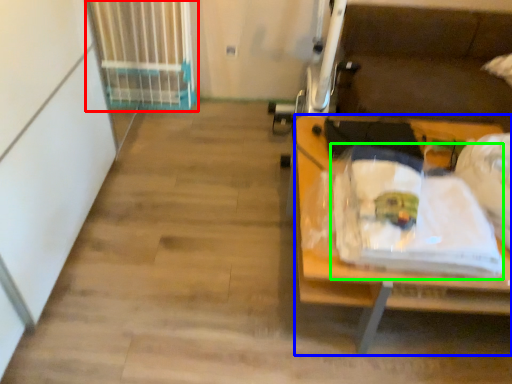
Question: Which object is the farthest from radiator (highlighted by a red box)? Choose among these: desk (highlighted by a blue box) or waste (highlighted by a green box).

Choices:
 (A) desk
 (B) waste

Answer: (A)